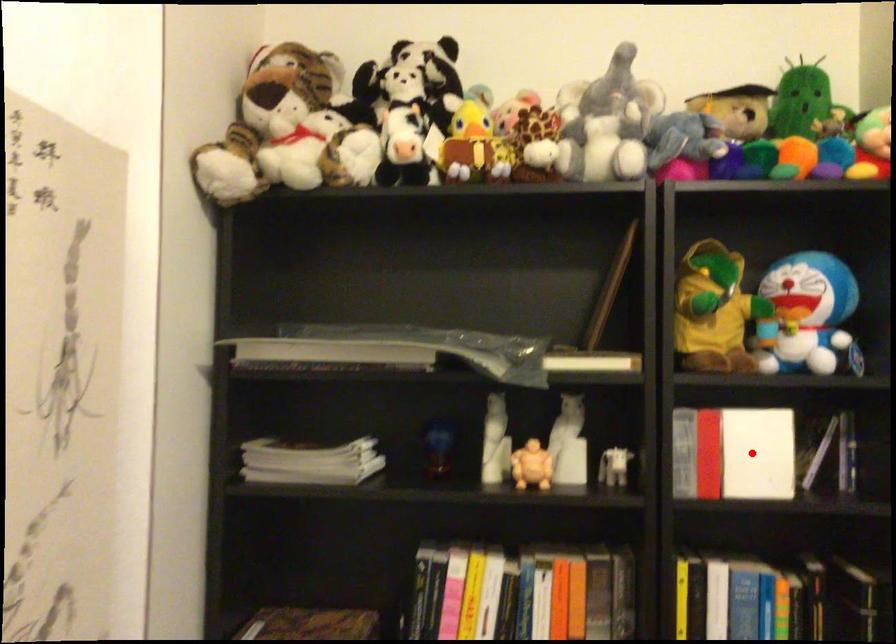
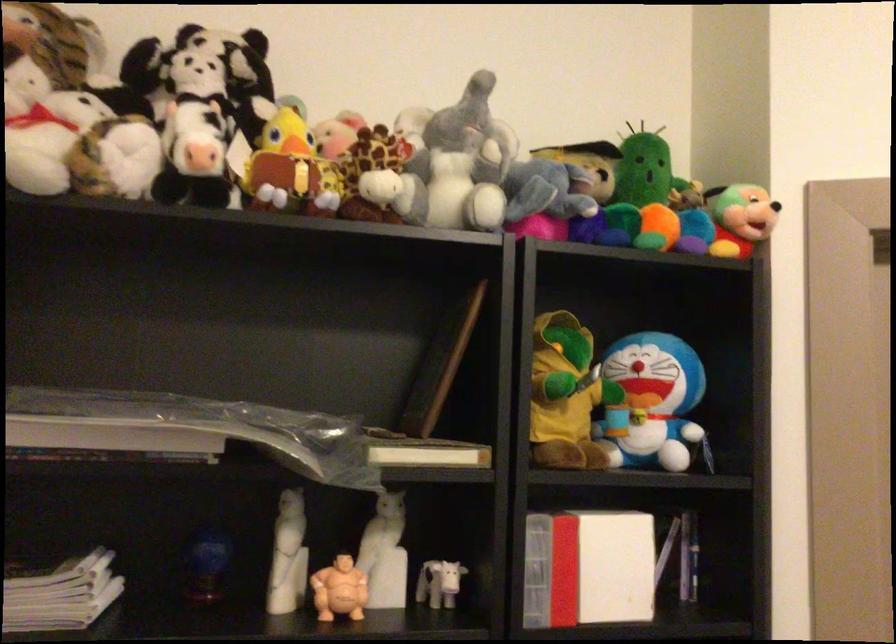
The point at the highlighted location is marked in the first image. Where is the corresponding point in the second image?

(609, 565)